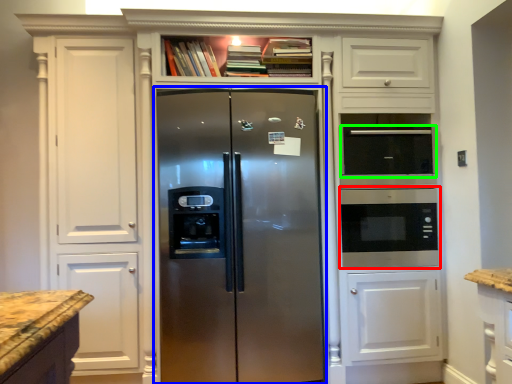
Question: Based on their relative distances, which object is nearer to microwave oven (highlighted by a red box)? Choose from refrigerator (highlighted by a blue box) and appliance (highlighted by a green box).

Choices:
 (A) refrigerator
 (B) appliance

Answer: (B)